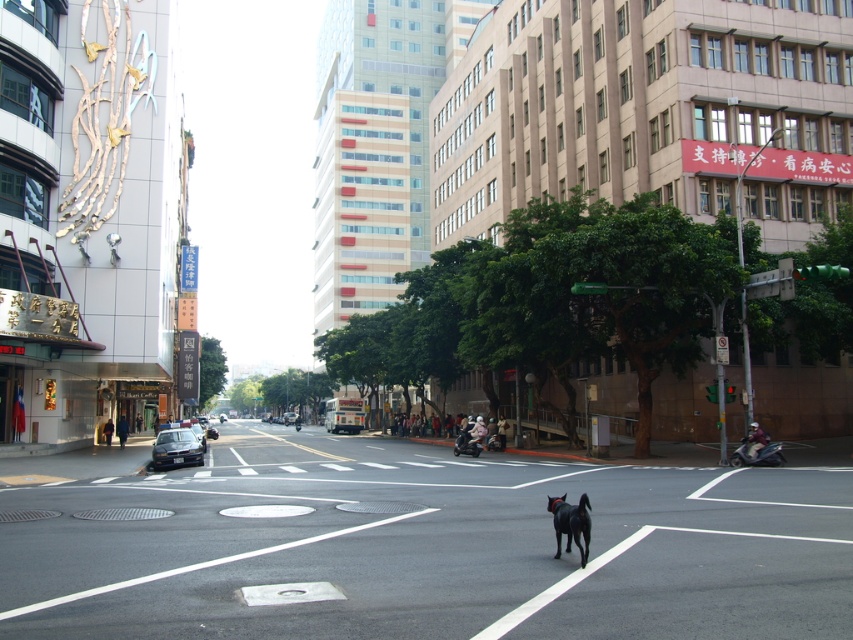
Is black glossy dog at center above shiny black sedan at center-left?

Yes, black glossy dog at center is above shiny black sedan at center-left.

Which is in front, point (564, 524) or point (200, 454)?

Point (564, 524) is more forward.

The height and width of the screenshot is (640, 853). Describe the element at coordinates (570, 524) in the screenshot. I see `black glossy dog at center` at that location.

Find the location of a particular element. This screenshot has height=640, width=853. black glossy dog at center is located at coordinates (570, 524).

Who is higher up, black asphalt road at center or black glossy dog at center?

black glossy dog at center is above.

Can you confirm if black asphalt road at center is positioned below black glossy dog at center?

Yes, black asphalt road at center is below black glossy dog at center.

This screenshot has height=640, width=853. Find the location of `black asphalt road at center`. black asphalt road at center is located at coordinates (424, 547).

Who is more forward, (560, 596) or (196, 458)?

Point (560, 596) is in front.

Looking at this image, measure the distance between black asphalt road at center and camera.

black asphalt road at center is 5.74 meters away from camera.

Identify the location of black asphalt road at center. The image size is (853, 640). (424, 547).